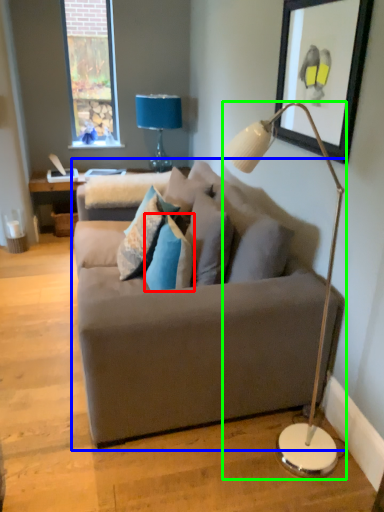
Question: Which is farther away from pillow (highlighted by a red box)? studio couch (highlighted by a blue box) or lamp (highlighted by a green box)?

Choices:
 (A) studio couch
 (B) lamp

Answer: (B)